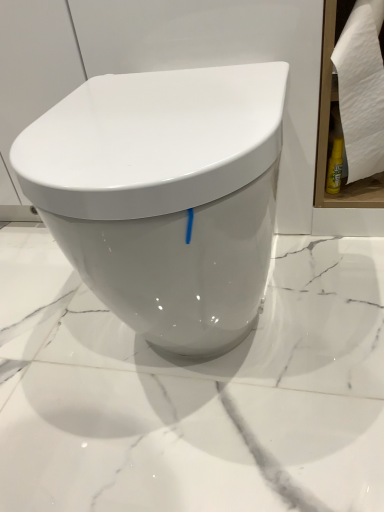
Question: Is white paper towel at right in front of white glossy toilet at center?

Choices:
 (A) yes
 (B) no

Answer: (B)

Question: Is white paper towel at right bigger than white glossy toilet at center?

Choices:
 (A) no
 (B) yes

Answer: (A)

Question: Does white paper towel at right contain white glossy toilet at center?

Choices:
 (A) yes
 (B) no

Answer: (B)

Question: Does white paper towel at right appear on the right side of white glossy toilet at center?

Choices:
 (A) yes
 (B) no

Answer: (A)

Question: Can you confirm if white paper towel at right is smaller than white glossy toilet at center?

Choices:
 (A) yes
 (B) no

Answer: (A)

Question: Can you confirm if white paper towel at right is wider than white glossy toilet at center?

Choices:
 (A) no
 (B) yes

Answer: (A)

Question: Is white glossy toilet at center wider than white paper towel at right?

Choices:
 (A) no
 (B) yes

Answer: (B)

Question: Considering the relative positions of white glossy toilet at center and white paper towel at right in the image provided, is white glossy toilet at center to the right of white paper towel at right from the viewer's perspective?

Choices:
 (A) yes
 (B) no

Answer: (B)

Question: From the image's perspective, does white glossy toilet at center appear higher than white paper towel at right?

Choices:
 (A) yes
 (B) no

Answer: (B)

Question: From a real-world perspective, is white glossy toilet at center positioned over white paper towel at right based on gravity?

Choices:
 (A) yes
 (B) no

Answer: (B)

Question: Are white glossy toilet at center and white paper towel at right beside each other?

Choices:
 (A) no
 (B) yes

Answer: (A)

Question: Is white glossy toilet at center positioned before white paper towel at right?

Choices:
 (A) no
 (B) yes

Answer: (B)

Question: Is point (167, 172) closer or farther from the camera than point (360, 160)?

Choices:
 (A) farther
 (B) closer

Answer: (B)